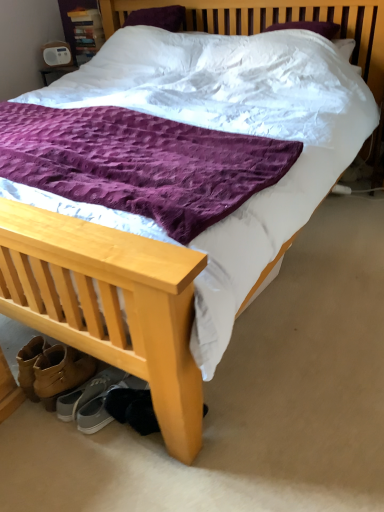
Question: Can you confirm if gray suede sneakers at lower left, which is counted as the first footwear, starting from the left, is shorter than dark gray suede shoes at lower left, which appears as the first footwear when viewed from the right?

Choices:
 (A) no
 (B) yes

Answer: (B)

Question: Is the surface of gray suede sneakers at lower left, which appears as the second footwear when viewed from the right, in direct contact with dark gray suede shoes at lower left, placed as the second footwear when sorted from left to right?

Choices:
 (A) no
 (B) yes

Answer: (A)

Question: Is gray suede sneakers at lower left, which is counted as the first footwear, starting from the left, aimed at dark gray suede shoes at lower left, which appears as the first footwear when viewed from the right?

Choices:
 (A) no
 (B) yes

Answer: (A)

Question: From the image's perspective, does gray suede sneakers at lower left, which appears as the second footwear when viewed from the right, appear lower than dark gray suede shoes at lower left, placed as the second footwear when sorted from left to right?

Choices:
 (A) yes
 (B) no

Answer: (B)

Question: Can you confirm if gray suede sneakers at lower left, which appears as the second footwear when viewed from the right, is taller than dark gray suede shoes at lower left, placed as the second footwear when sorted from left to right?

Choices:
 (A) no
 (B) yes

Answer: (A)

Question: Can you confirm if gray suede sneakers at lower left, which is counted as the first footwear, starting from the left, is bigger than dark gray suede shoes at lower left, placed as the second footwear when sorted from left to right?

Choices:
 (A) yes
 (B) no

Answer: (B)

Question: Can you confirm if dark gray suede shoes at lower left, which appears as the first footwear when viewed from the right, is wider than gray suede sneakers at lower left, which appears as the second footwear when viewed from the right?

Choices:
 (A) yes
 (B) no

Answer: (B)

Question: Is dark gray suede shoes at lower left, which appears as the first footwear when viewed from the right, not within gray suede sneakers at lower left, which appears as the second footwear when viewed from the right?

Choices:
 (A) no
 (B) yes

Answer: (B)

Question: Considering the relative sizes of dark gray suede shoes at lower left, which appears as the first footwear when viewed from the right, and gray suede sneakers at lower left, which is counted as the first footwear, starting from the left, in the image provided, is dark gray suede shoes at lower left, which appears as the first footwear when viewed from the right, smaller than gray suede sneakers at lower left, which is counted as the first footwear, starting from the left,?

Choices:
 (A) yes
 (B) no

Answer: (B)

Question: Can you confirm if dark gray suede shoes at lower left, which appears as the first footwear when viewed from the right, is shorter than gray suede sneakers at lower left, which appears as the second footwear when viewed from the right?

Choices:
 (A) no
 (B) yes

Answer: (A)

Question: Does dark gray suede shoes at lower left, which appears as the first footwear when viewed from the right, have a greater height compared to gray suede sneakers at lower left, which is counted as the first footwear, starting from the left?

Choices:
 (A) no
 (B) yes

Answer: (B)

Question: Considering the relative sizes of dark gray suede shoes at lower left, which appears as the first footwear when viewed from the right, and gray suede sneakers at lower left, which is counted as the first footwear, starting from the left, in the image provided, is dark gray suede shoes at lower left, which appears as the first footwear when viewed from the right, thinner than gray suede sneakers at lower left, which is counted as the first footwear, starting from the left,?

Choices:
 (A) yes
 (B) no

Answer: (A)

Question: Based on their sizes in the image, would you say gray suede sneakers at lower left, which appears as the second footwear when viewed from the right, is bigger or smaller than dark gray suede shoes at lower left, placed as the second footwear when sorted from left to right?

Choices:
 (A) small
 (B) big

Answer: (A)